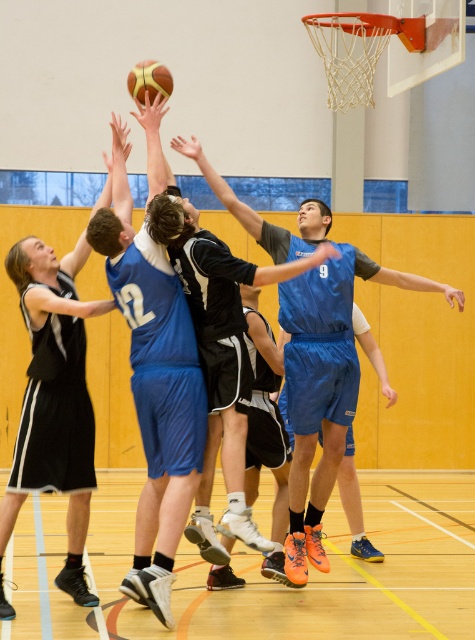
Question: Does blue matte basketball at center have a larger size compared to shiny golden basketball at upper center?

Choices:
 (A) yes
 (B) no

Answer: (A)

Question: Which point is closer to the camera?

Choices:
 (A) pos(134,339)
 (B) pos(8,504)

Answer: (A)

Question: Does blue matte basketball at center come in front of black jersey at center?

Choices:
 (A) yes
 (B) no

Answer: (A)

Question: Which object appears farthest from the camera in this image?

Choices:
 (A) black jersey at center
 (B) shiny golden basketball at upper center

Answer: (B)

Question: Which point is closer to the camera?

Choices:
 (A) black jersey at center
 (B) shiny golden basketball at upper center

Answer: (A)

Question: Can you confirm if blue jersey at center is positioned above shiny golden basketball at upper center?

Choices:
 (A) yes
 (B) no

Answer: (B)